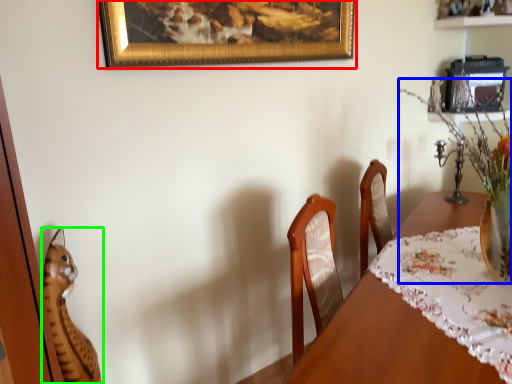
Question: Based on their relative distances, which object is nearer to picture frame (highlighted by a red box)? Choose from floral arrangement (highlighted by a blue box) and cat (highlighted by a green box).

Choices:
 (A) floral arrangement
 (B) cat

Answer: (A)